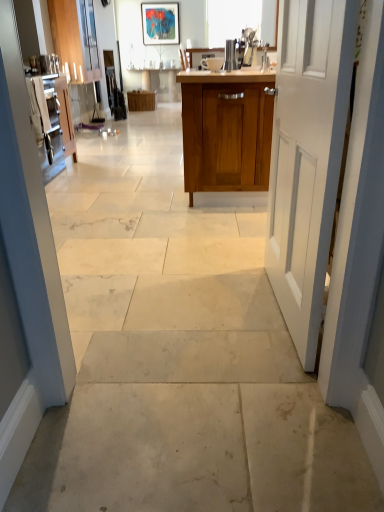
The width and height of the screenshot is (384, 512). Find the location of `free space to the back side of white matte door at right`. free space to the back side of white matte door at right is located at coordinates (225, 263).